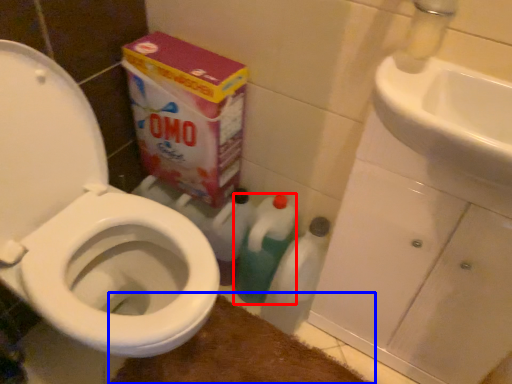
Question: Which object appears farthest to the camera in this image, cleaning product (highlighted by a red box) or bath mat (highlighted by a blue box)?

Choices:
 (A) cleaning product
 (B) bath mat

Answer: (A)